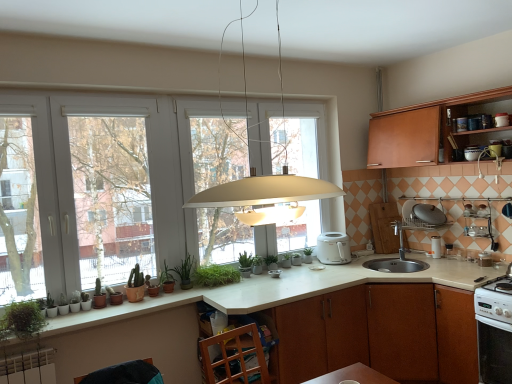
Question: Considering the relative sizes of brown wood cabinet at lower center, which ranks as the second cabinetry in top-to-bottom order, and white glossy oven at lower right, the first kitchen appliance ordered from the bottom, in the image provided, is brown wood cabinet at lower center, which ranks as the second cabinetry in top-to-bottom order, shorter than white glossy oven at lower right, the first kitchen appliance ordered from the bottom,?

Choices:
 (A) yes
 (B) no

Answer: (B)

Question: Considering the relative sizes of brown wood cabinet at lower center, which ranks as the second cabinetry in top-to-bottom order, and white glossy oven at lower right, which is counted as the second kitchen appliance, starting from the top, in the image provided, is brown wood cabinet at lower center, which ranks as the second cabinetry in top-to-bottom order, wider than white glossy oven at lower right, which is counted as the second kitchen appliance, starting from the top,?

Choices:
 (A) no
 (B) yes

Answer: (B)

Question: Could white glossy oven at lower right, the 2th kitchen appliance from the back, be considered to be inside brown wood cabinet at lower center, which ranks as the second cabinetry in top-to-bottom order?

Choices:
 (A) yes
 (B) no

Answer: (B)

Question: Is brown wood cabinet at lower center, which ranks as the second cabinetry in top-to-bottom order, touching white glossy oven at lower right, the first kitchen appliance ordered from the bottom?

Choices:
 (A) yes
 (B) no

Answer: (B)

Question: Is brown wood cabinet at lower center, which ranks as the second cabinetry in top-to-bottom order, further to the viewer compared to white glossy oven at lower right, marked as the first kitchen appliance in a right-to-left arrangement?

Choices:
 (A) no
 (B) yes

Answer: (B)

Question: Is white glossy gas stove at lower right inside the boundaries of green matte plant at center, which is the fourth plant in front-to-back order, or outside?

Choices:
 (A) inside
 (B) outside

Answer: (B)

Question: In the image, is white glossy gas stove at lower right on the left side or the right side of green matte plant at center, placed as the 2th plant when sorted from right to left?

Choices:
 (A) left
 (B) right

Answer: (B)

Question: From a real-world perspective, is white glossy gas stove at lower right physically located above or below green matte plant at center, which appears as the fifth plant when viewed from the left?

Choices:
 (A) below
 (B) above

Answer: (A)

Question: Is white glossy gas stove at lower right taller or shorter than green matte plant at center, which is the fourth plant in front-to-back order?

Choices:
 (A) short
 (B) tall

Answer: (B)

Question: From a real-world perspective, relative to wooden cabinet at upper right, marked as the first cabinetry in a top-to-bottom arrangement, is green matte plant at lower left, the third plant when ordered from right to left, vertically above or below?

Choices:
 (A) above
 (B) below

Answer: (B)

Question: In terms of height, does green matte plant at lower left, acting as the 5th plant starting from the front, look taller or shorter compared to wooden cabinet at upper right, marked as the first cabinetry in a top-to-bottom arrangement?

Choices:
 (A) short
 (B) tall

Answer: (A)

Question: Relative to wooden cabinet at upper right, marked as the first cabinetry in a top-to-bottom arrangement, is green matte plant at lower left, acting as the 5th plant starting from the front, in front or behind?

Choices:
 (A) front
 (B) behind

Answer: (B)

Question: Considering the relative positions of green matte plant at lower left, arranged as the 4th plant when viewed from the left, and wooden cabinet at upper right, marked as the first cabinetry in a top-to-bottom arrangement, in the image provided, is green matte plant at lower left, arranged as the 4th plant when viewed from the left, to the left or to the right of wooden cabinet at upper right, marked as the first cabinetry in a top-to-bottom arrangement,?

Choices:
 (A) right
 (B) left

Answer: (B)

Question: Considering their positions, is satin nickel sink at lower right located in front of or behind metallic silver toaster at upper right, which is the 2th appliance in right-to-left order?

Choices:
 (A) behind
 (B) front

Answer: (A)

Question: From a real-world perspective, is satin nickel sink at lower right above or below metallic silver toaster at upper right, which is the second appliance in top-to-bottom order?

Choices:
 (A) below
 (B) above

Answer: (A)